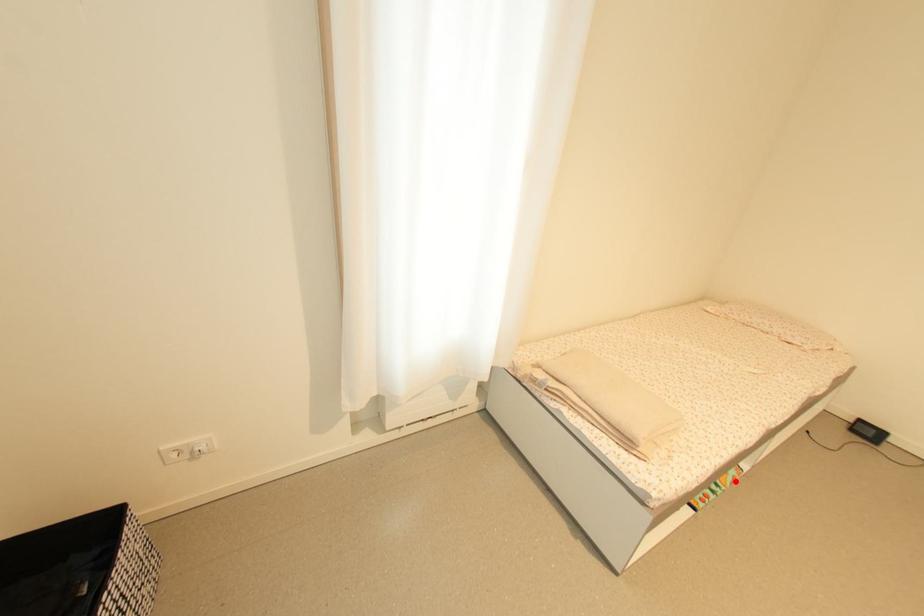
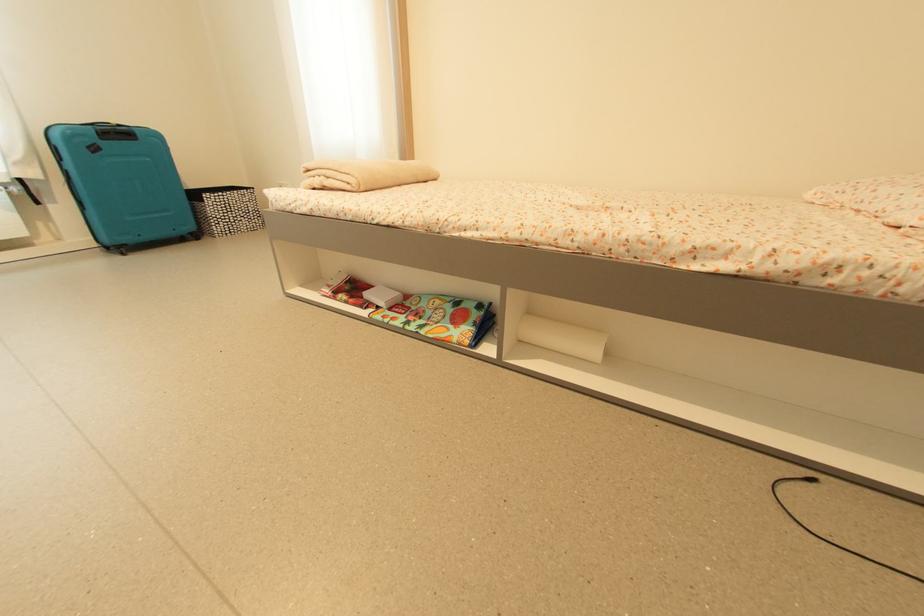
Question: I am providing you with two images of the same scene from different viewpoints. A red point is shown in image1. For the corresponding object point in image2, is it positioned nearer or farther from the camera?

Choices:
 (A) Nearer
 (B) Farther

Answer: (B)